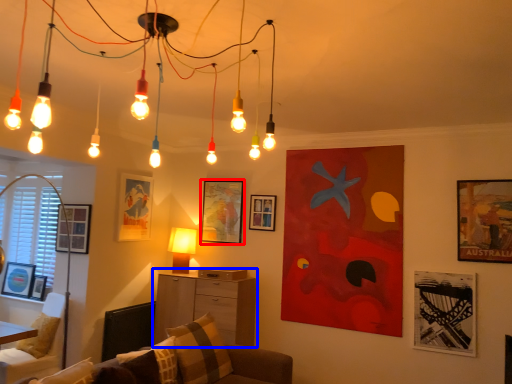
Question: Among these objects, which one is nearest to the camera, picture frame (highlighted by a red box) or dresser (highlighted by a blue box)?

Choices:
 (A) picture frame
 (B) dresser

Answer: (B)